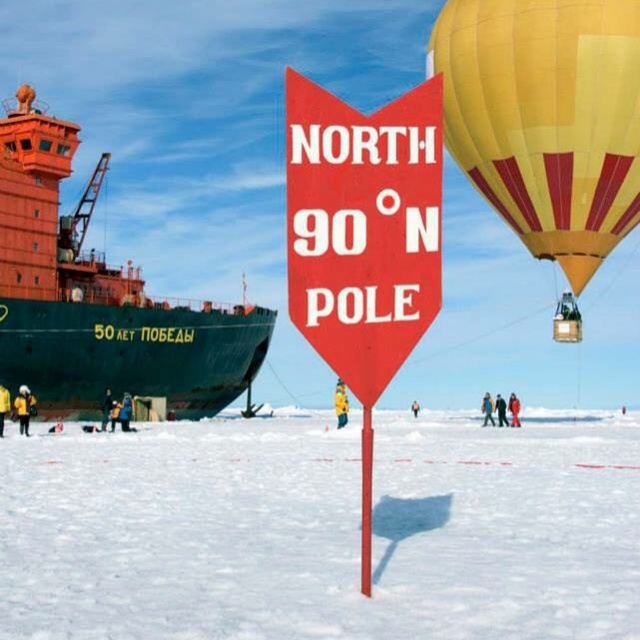
Question: Which object appears farthest from the camera in this image?

Choices:
 (A) white powdery snow at center
 (B) green matte ship at left

Answer: (B)

Question: In this image, where is white powdery snow at center located relative to yellow fabric balloon at upper right?

Choices:
 (A) above
 (B) below

Answer: (B)

Question: Among these objects, which one is farthest from the camera?

Choices:
 (A) white powdery snow at center
 (B) green matte ship at left

Answer: (B)

Question: Can you confirm if green matte ship at left is positioned to the right of red plastic sign at center?

Choices:
 (A) yes
 (B) no

Answer: (B)

Question: Where is yellow fabric balloon at upper right located in relation to red plastic sign at center in the image?

Choices:
 (A) left
 (B) right

Answer: (B)

Question: Among these points, which one is farthest from the camera?

Choices:
 (A) (636, 124)
 (B) (125, 451)
 (C) (305, 278)
 (D) (74, 376)

Answer: (D)